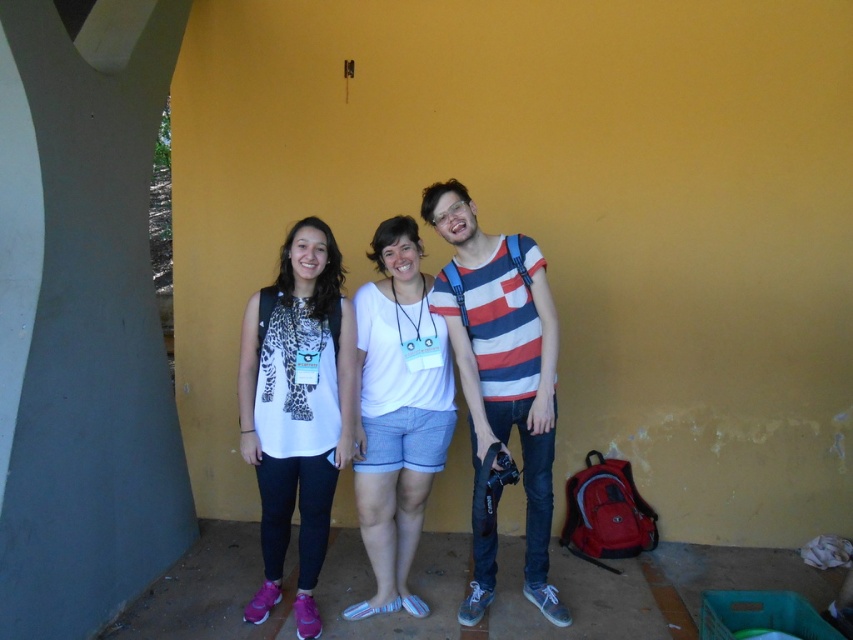
You are a photographer trying to capture a clear shot of the white matte shirt at center and the striped cotton shirt at center. Since both are at the center, which one is closer to the camera?

The white matte shirt at center is positioned under the striped cotton shirt at center, so the striped cotton shirt at center is closer to the camera.

You are trying to decide which of the two people in the center has a taller shirt. You see the white matte shirt at center and the striped cotton shirt at center. Which one is taller?

The striped cotton shirt at center is taller than the white matte shirt at center because the white matte shirt at center is not as tall as striped cotton shirt at center.

You are standing at the entrance of the covered outdoor area and want to take a photo of the striped cotton shirt at center. The camera you have can focus on objects up to 10 feet away. Can you take the photo without moving closer?

The striped cotton shirt at center is 9.38 feet away, so yes, the camera can focus on it since it is within the 10 feet range.